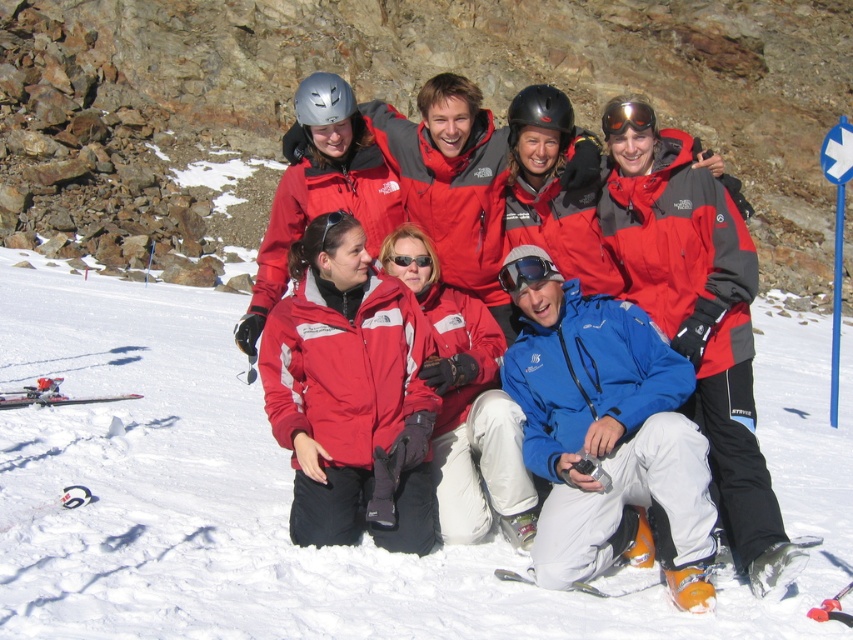
Can you confirm if matte red jacket at center is taller than orange reflective lens goggles at upper center?

Indeed, matte red jacket at center has a greater height compared to orange reflective lens goggles at upper center.

Who is more forward, (302, 452) or (634, 106)?

Point (302, 452)

Find the location of a particular element. The image size is (853, 640). matte red jacket at center is located at coordinates (350, 394).

Consider the image. Is white powder snow at center below matte red ski jacket at center?

Correct, white powder snow at center is located below matte red ski jacket at center.

Who is more forward, (584,608) or (735,500)?

Point (584,608)

Find the location of `white powder snow at center`. white powder snow at center is located at coordinates (289, 492).

This screenshot has width=853, height=640. Identify the location of white powder snow at center. (289, 492).

Who is lower down, white powder snow at center or blue matte jacket at lower center?

blue matte jacket at lower center is below.

The height and width of the screenshot is (640, 853). I want to click on white powder snow at center, so click(289, 492).